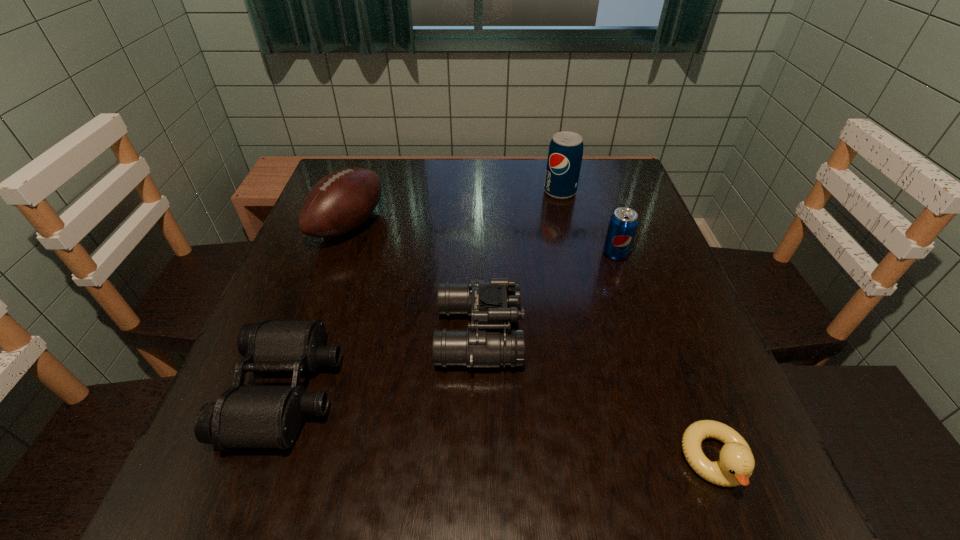
Where is `pop soda that is at the right edge`? The width and height of the screenshot is (960, 540). pop soda that is at the right edge is located at coordinates (623, 223).

This screenshot has width=960, height=540. What are the coordinates of `duckling positioned at the right edge` in the screenshot? It's located at (736, 464).

Where is `object present at the far left corner`? object present at the far left corner is located at coordinates (340, 202).

Find the location of a particular element. The height and width of the screenshot is (540, 960). object situated at the near left corner is located at coordinates (244, 416).

Locate an element on the screen. object located in the near right corner section of the desktop is located at coordinates (736, 464).

In the image, there is a desktop. Identify the location of vacant space at the far edge. This screenshot has height=540, width=960. (518, 165).

Where is `vacant space at the near edge`? vacant space at the near edge is located at coordinates (501, 468).

In the image, there is a desktop. Identify the location of vacant space at the left edge. (336, 245).

You are a GUI agent. You are given a task and a screenshot of the screen. Output one action in this format:
    pyautogui.click(x=<x>, y=<y>)
    Task: Click on the free space at the right edge of the desktop
    The image size is (960, 540).
    Given the screenshot: What is the action you would take?
    pyautogui.click(x=610, y=305)

Where is `vacant region at the near left corner`? The height and width of the screenshot is (540, 960). vacant region at the near left corner is located at coordinates (211, 516).